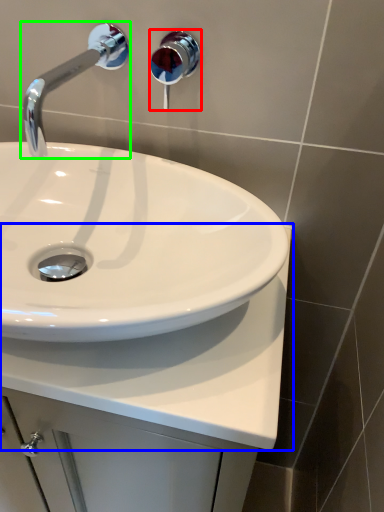
Question: Based on their relative distances, which object is farther from shower (highlighted by a red box)? Choose from counter top (highlighted by a blue box) and tap (highlighted by a green box).

Choices:
 (A) counter top
 (B) tap

Answer: (A)